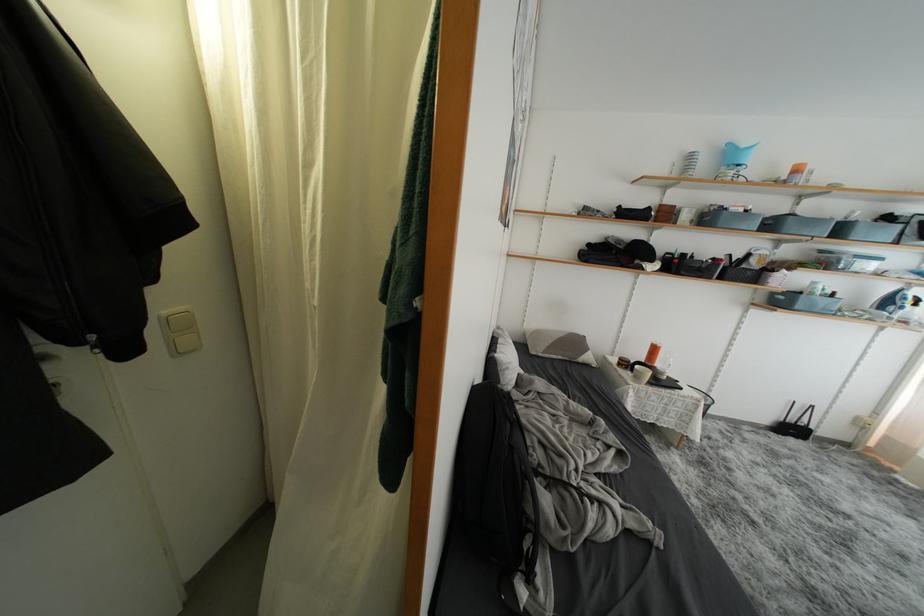
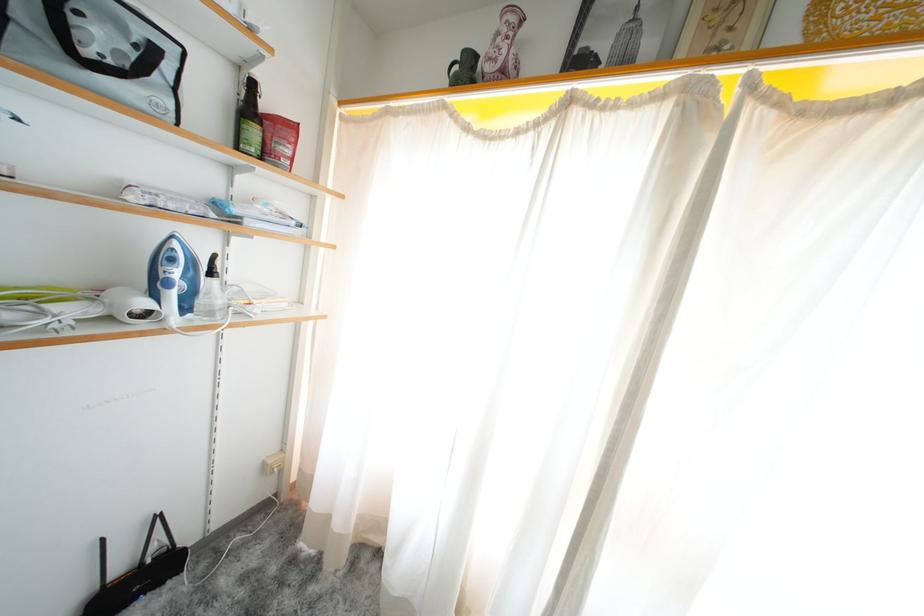
Locate, in the second image, the point that corresponds to point (894, 440) in the first image.

(306, 475)